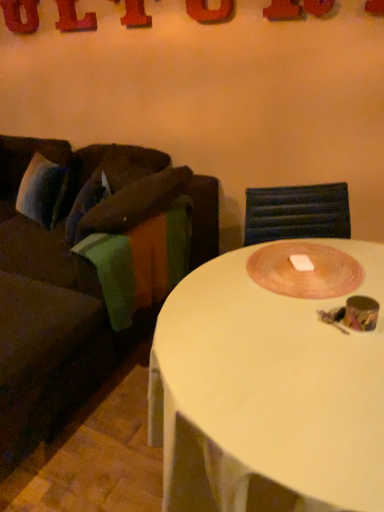
Question: Considering the positions of wooden placemat at center and red plastic letter at upper right, which is counted as the 5th letter, starting from the back, in the image, is wooden placemat at center wider or thinner than red plastic letter at upper right, which is counted as the 5th letter, starting from the back,?

Choices:
 (A) thin
 (B) wide

Answer: (B)

Question: Based on their sizes in the image, would you say wooden placemat at center is bigger or smaller than red plastic letter at upper right, which appears as the first letter when viewed from the right?

Choices:
 (A) small
 (B) big

Answer: (B)

Question: Which is farther from the matte orange letter at upper center, the 2th letter in the front-to-back sequence?

Choices:
 (A) metallic red letter at upper center, the 3th letter when ordered from right to left
 (B) red plastic letter at upper right, which appears as the first letter when viewed from the right
 (C) wooden placemat at center
 (D) red plastic letter l at upper left, which is counted as the 4th letter, starting from the right
 (E) red plastic letter at upper left, which ranks as the first letter in left-to-right order

Answer: (C)

Question: Considering the real-world distances, which object is farthest from the metallic red letter at upper center, arranged as the third letter when viewed from the front?

Choices:
 (A) white plastic coffee table at center
 (B) red plastic letter at upper left, which appears as the 5th letter when viewed from the right
 (C) red plastic letter l at upper left, which ranks as the fourth letter in front-to-back order
 (D) wooden placemat at center
 (E) brown fabric couch at left

Answer: (A)